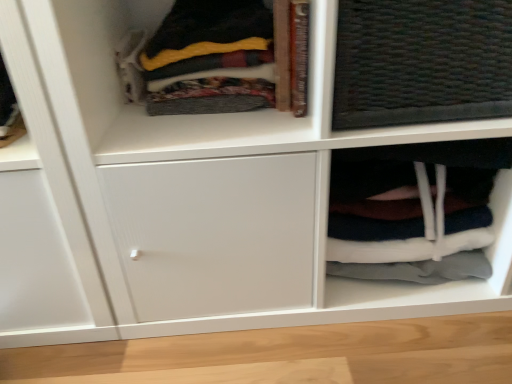
Question: From a real-world perspective, is white fabric at lower right beneath soft fleece blanket at upper left?

Choices:
 (A) yes
 (B) no

Answer: (A)

Question: Considering the relative sizes of white fabric at lower right and soft fleece blanket at upper left in the image provided, is white fabric at lower right wider than soft fleece blanket at upper left?

Choices:
 (A) no
 (B) yes

Answer: (A)

Question: Is white fabric at lower right far from soft fleece blanket at upper left?

Choices:
 (A) yes
 (B) no

Answer: (B)

Question: Considering the relative sizes of white fabric at lower right and soft fleece blanket at upper left in the image provided, is white fabric at lower right taller than soft fleece blanket at upper left?

Choices:
 (A) no
 (B) yes

Answer: (B)

Question: Does white fabric at lower right appear on the right side of soft fleece blanket at upper left?

Choices:
 (A) no
 (B) yes

Answer: (B)

Question: Could you tell me if white fabric at lower right is facing soft fleece blanket at upper left?

Choices:
 (A) no
 (B) yes

Answer: (A)

Question: From a real-world perspective, is soft fleece blanket at upper left on white fabric at lower right?

Choices:
 (A) yes
 (B) no

Answer: (A)

Question: From the image's perspective, is soft fleece blanket at upper left located above white fabric at lower right?

Choices:
 (A) no
 (B) yes

Answer: (B)

Question: Does soft fleece blanket at upper left have a greater height compared to white fabric at lower right?

Choices:
 (A) yes
 (B) no

Answer: (B)

Question: Is white fabric at lower right a part of soft fleece blanket at upper left?

Choices:
 (A) no
 (B) yes

Answer: (A)

Question: Considering the relative positions of soft fleece blanket at upper left and white fabric at lower right in the image provided, is soft fleece blanket at upper left to the right of white fabric at lower right from the viewer's perspective?

Choices:
 (A) yes
 (B) no

Answer: (B)

Question: Does soft fleece blanket at upper left have a lesser height compared to white fabric at lower right?

Choices:
 (A) yes
 (B) no

Answer: (A)

Question: Relative to soft fleece blanket at upper left, is white fabric at lower right in front or behind?

Choices:
 (A) front
 (B) behind

Answer: (B)